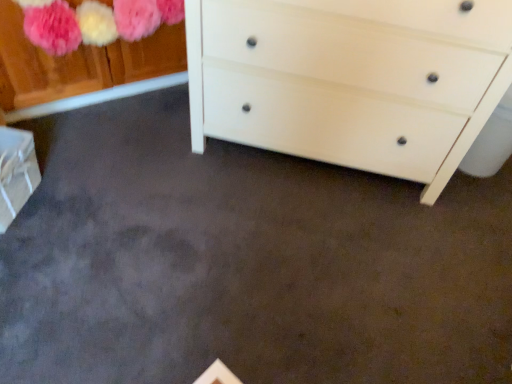
Where is `white cardboard box at lower left`? The image size is (512, 384). white cardboard box at lower left is located at coordinates (16, 172).

What do you see at coordinates (16, 172) in the screenshot?
I see `white cardboard box at lower left` at bounding box center [16, 172].

The width and height of the screenshot is (512, 384). Describe the element at coordinates (350, 79) in the screenshot. I see `white matte chest of drawers at center` at that location.

The image size is (512, 384). Identify the location of white matte chest of drawers at center. (350, 79).

You are a GUI agent. You are given a task and a screenshot of the screen. Output one action in this format:
    pyautogui.click(x=<x>, y=<y>)
    Task: Click on the white cardboard box at lower left
    The height and width of the screenshot is (384, 512).
    Given the screenshot: What is the action you would take?
    pyautogui.click(x=16, y=172)

Based on the photo, would you say white cardboard box at lower left is to the left or to the right of white matte chest of drawers at center in the picture?

From the image, it's evident that white cardboard box at lower left is to the left of white matte chest of drawers at center.

In the image, is white cardboard box at lower left positioned in front of or behind white matte chest of drawers at center?

Visually, white cardboard box at lower left is located behind white matte chest of drawers at center.

Considering the points (9, 218) and (276, 105), which point is in front, point (9, 218) or point (276, 105)?

The point (9, 218) is more forward.

From the image's perspective, is white cardboard box at lower left located above white matte chest of drawers at center?

No, from the image's perspective, white cardboard box at lower left is not on top of white matte chest of drawers at center.

From a real-world perspective, between white cardboard box at lower left and white matte chest of drawers at center, who is vertically lower?

white cardboard box at lower left, from a real-world perspective.

Does white cardboard box at lower left have a lesser width compared to white matte chest of drawers at center?

Indeed, white cardboard box at lower left has a lesser width compared to white matte chest of drawers at center.

Which of these two, white cardboard box at lower left or white matte chest of drawers at center, stands taller?

With more height is white matte chest of drawers at center.

Which of these two, white cardboard box at lower left or white matte chest of drawers at center, is smaller?

Smaller between the two is white cardboard box at lower left.

Which is correct: white cardboard box at lower left is inside white matte chest of drawers at center, or outside of it?

white cardboard box at lower left lies outside white matte chest of drawers at center.

Are white cardboard box at lower left and white matte chest of drawers at center making contact?

white cardboard box at lower left and white matte chest of drawers at center are not in contact.

Could you tell me if white cardboard box at lower left is facing white matte chest of drawers at center?

No, white cardboard box at lower left is not oriented towards white matte chest of drawers at center.

How different are the orientations of white cardboard box at lower left and white matte chest of drawers at center in degrees?

They differ by 92 degrees in their facing directions.

This screenshot has height=384, width=512. I want to click on cabinetry that appears on the left of white matte chest of drawers at center, so tap(16, 172).

Which object is positioned more to the left, white matte chest of drawers at center or white cardboard box at lower left?

From the viewer's perspective, white cardboard box at lower left appears more on the left side.

Which is in front, white matte chest of drawers at center or white cardboard box at lower left?

white matte chest of drawers at center.

Does point (398, 165) appear closer or farther from the camera than point (16, 142)?

Point (398, 165) is positioned farther from the camera compared to point (16, 142).

From the image's perspective, between white matte chest of drawers at center and white cardboard box at lower left, who is located below?

white cardboard box at lower left, from the image's perspective.

From a real-world perspective, is white matte chest of drawers at center beneath white cardboard box at lower left?

No, from a real-world perspective, white matte chest of drawers at center is not under white cardboard box at lower left.

Is white matte chest of drawers at center wider than white cardboard box at lower left?

Yes.

Considering the sizes of white matte chest of drawers at center and white cardboard box at lower left in the image, is white matte chest of drawers at center taller or shorter than white cardboard box at lower left?

Clearly, white matte chest of drawers at center is taller compared to white cardboard box at lower left.

Consider the image. Which of these two, white matte chest of drawers at center or white cardboard box at lower left, is bigger?

Bigger between the two is white matte chest of drawers at center.

Does white matte chest of drawers at center contain white cardboard box at lower left?

That's incorrect, white cardboard box at lower left is not inside white matte chest of drawers at center.

Are white matte chest of drawers at center and white cardboard box at lower left located far from each other?

No, white matte chest of drawers at center is not far from white cardboard box at lower left.

Is white matte chest of drawers at center aimed at white cardboard box at lower left?

No, white matte chest of drawers at center is not aimed at white cardboard box at lower left.

How different are the orientations of white matte chest of drawers at center and white cardboard box at lower left in degrees?

The angle between the facing direction of white matte chest of drawers at center and the facing direction of white cardboard box at lower left is 92 degrees.

How distant is white matte chest of drawers at center from white cardboard box at lower left?

white matte chest of drawers at center and white cardboard box at lower left are 99.11 centimeters apart from each other.

This screenshot has width=512, height=384. What are the coordinates of `cabinetry located underneath the white matte chest of drawers at center (from a real-world perspective)` in the screenshot? It's located at (16, 172).

At what (x,y) coordinates should I click in order to perform the action: click on cabinetry located on the left of white matte chest of drawers at center. Please return your answer as a coordinate pair (x, y). The width and height of the screenshot is (512, 384). Looking at the image, I should click on (16, 172).

Image resolution: width=512 pixels, height=384 pixels. In order to click on cabinetry behind the white matte chest of drawers at center in this screenshot , I will do `click(16, 172)`.